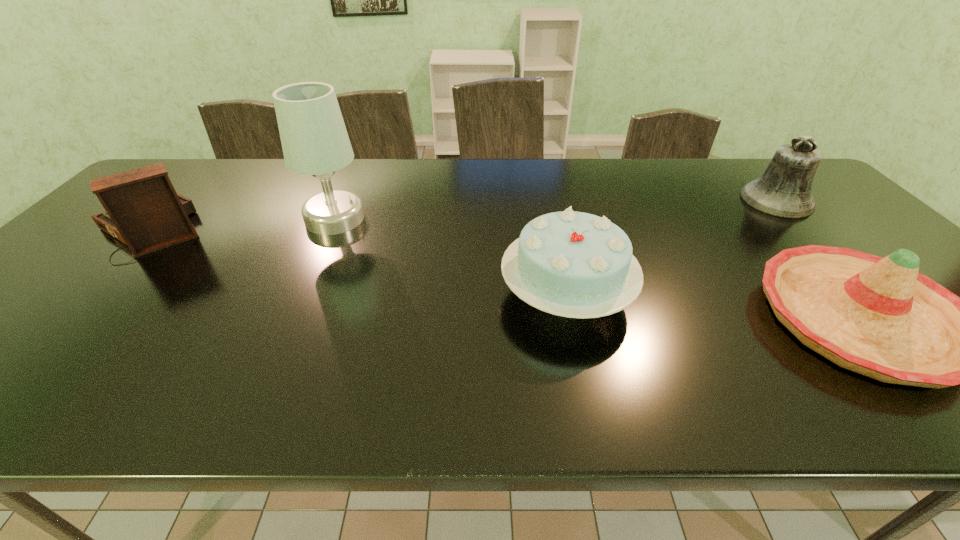
Identify the location of vacant space in between the bell and the lampshade. (556, 209).

Find the location of a particular element. vacant area between the birthday cake and the bell is located at coordinates (671, 247).

You are a GUI agent. You are given a task and a screenshot of the screen. Output one action in this format:
    pyautogui.click(x=<x>, y=<y>)
    Task: Click on the object that is the closest one to the phonograph record
    The height and width of the screenshot is (540, 960).
    Given the screenshot: What is the action you would take?
    pyautogui.click(x=314, y=139)

Identify which object is located as the fourth nearest to the bell. Please provide its 2D coordinates. Your answer should be formatted as a tuple, i.e. [(x, y)], where the tuple contains the x and y coordinates of a point satisfying the conditions above.

[(143, 210)]

Identify the location of vacant area in the image that satisfies the following two spatial constraints: 1. on the back side of the bell; 2. on the left side of the third object from right to left. (546, 200).

Where is `free space that satisfies the following two spatial constraints: 1. on the base of the birthday cake; 2. on the right side of the tallest object`? The height and width of the screenshot is (540, 960). free space that satisfies the following two spatial constraints: 1. on the base of the birthday cake; 2. on the right side of the tallest object is located at coordinates tap(301, 294).

Identify the location of vacant space that satisfies the following two spatial constraints: 1. on the base of the lampshade; 2. on the right side of the third object from left to right. The width and height of the screenshot is (960, 540). (301, 294).